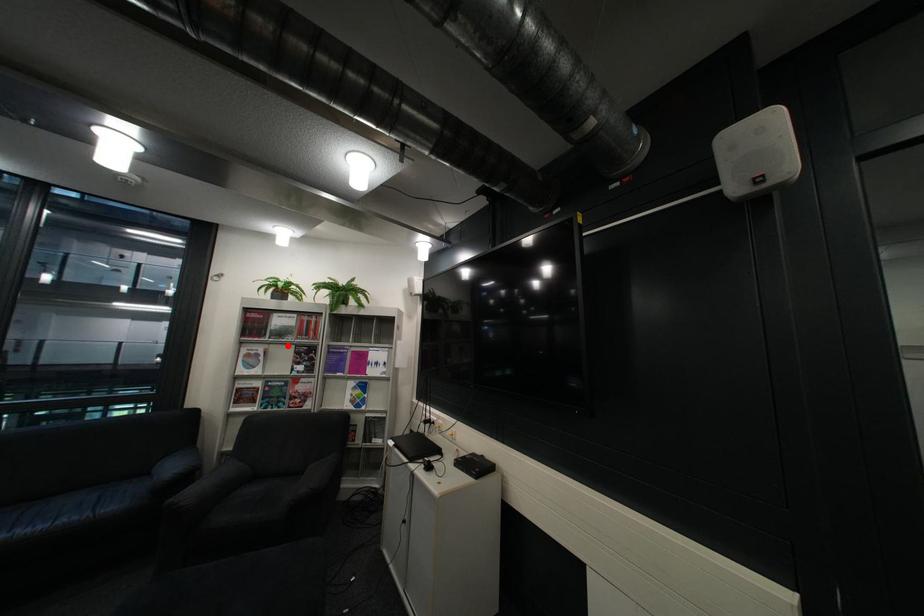
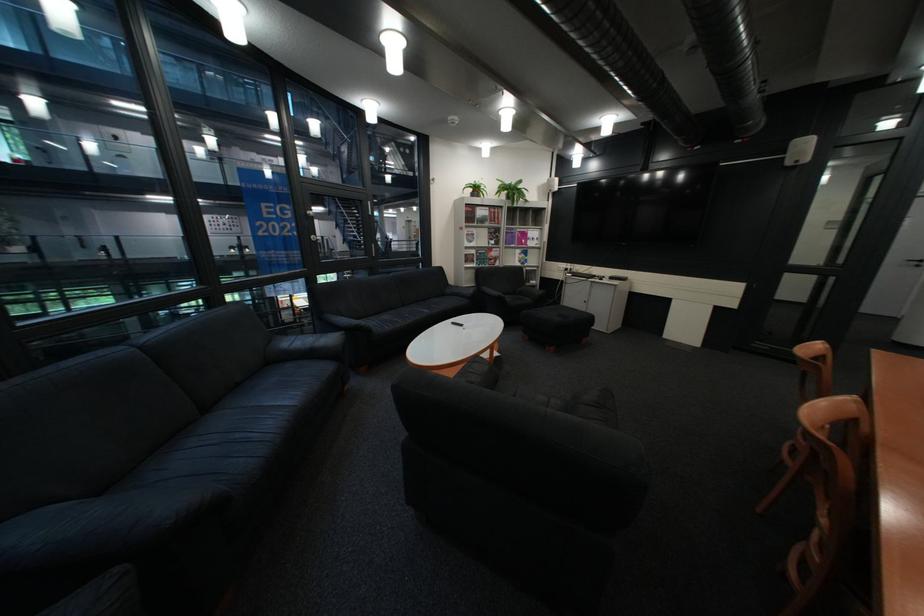
Question: I am providing you with two images of the same scene from different viewpoints. Given a red point in image1, look at the same physical point in image2. Is it:

Choices:
 (A) Closer to the viewpoint
 (B) Farther from the viewpoint

Answer: (A)